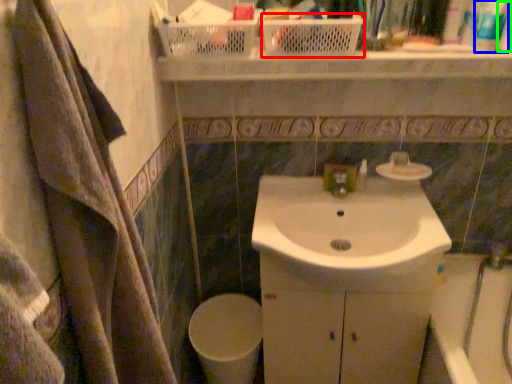
Question: Considering the real-world distances, which object is closest to basket (highlighted by a red box)? toiletry (highlighted by a blue box) or toiletry (highlighted by a green box).

Choices:
 (A) toiletry
 (B) toiletry

Answer: (A)